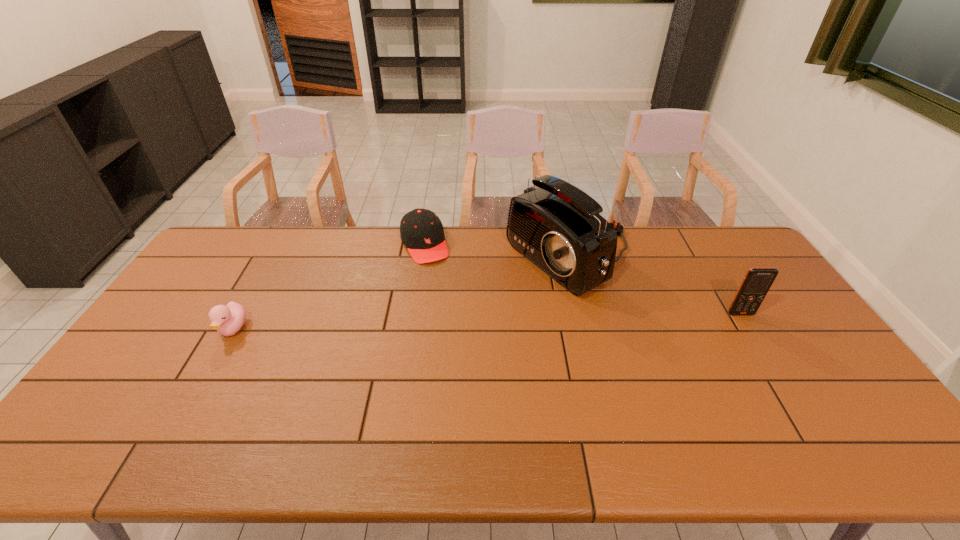
Where is `object that is the closest to the rightmost object`? object that is the closest to the rightmost object is located at coordinates (557, 226).